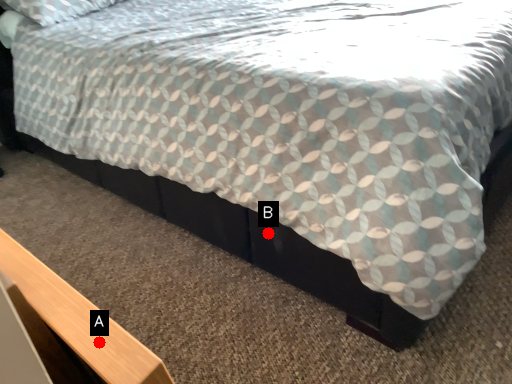
Question: Two points are circled on the image, labeled by A and B beside each circle. Which point appears closest to the camera in this image?

Choices:
 (A) A is closer
 (B) B is closer

Answer: (A)